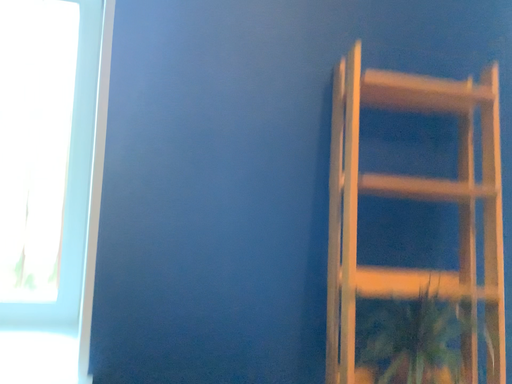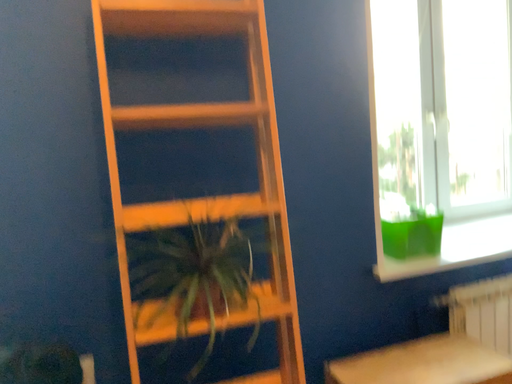
Question: Which way did the camera rotate in the video?

Choices:
 (A) rotated left
 (B) rotated right

Answer: (B)